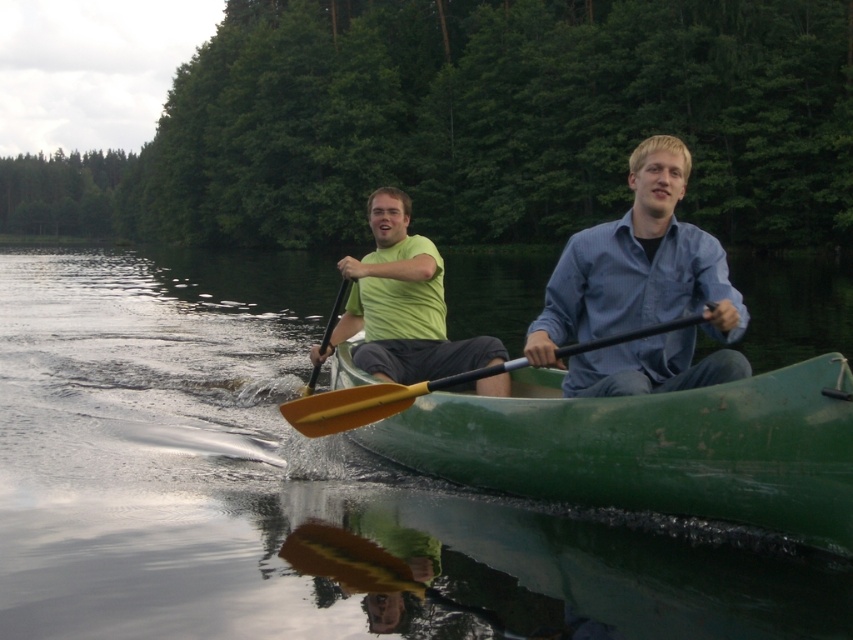
Question: Considering the real-world distances, which object is farthest from the yellow wood paddle at center?

Choices:
 (A) green matte canoe at center
 (B) green rubber canoe at center

Answer: (B)

Question: Is blue cotton shirt at center positioned at the back of matte green shirt at center?

Choices:
 (A) yes
 (B) no

Answer: (B)

Question: Can you confirm if green rubber canoe at center is wider than matte green shirt at center?

Choices:
 (A) no
 (B) yes

Answer: (B)

Question: Which is farther from the green rubber canoe at center?

Choices:
 (A) blue cotton shirt at center
 (B) yellow wood paddle at center
 (C) matte green shirt at center
 (D) green matte canoe at center

Answer: (A)

Question: In this image, where is green rubber canoe at center located relative to green matte canoe at center?

Choices:
 (A) below
 (B) above

Answer: (B)

Question: Which point is closer to the camera?

Choices:
 (A) green matte canoe at center
 (B) green rubber canoe at center
 (C) matte green shirt at center

Answer: (A)